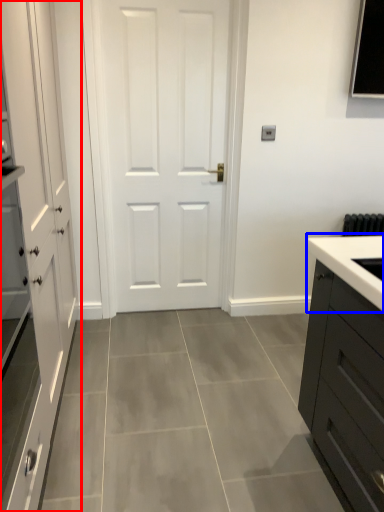
Question: Which point is closer to the camera, cabinetry (highlighted by a red box) or sink (highlighted by a blue box)?

Choices:
 (A) cabinetry
 (B) sink

Answer: (A)